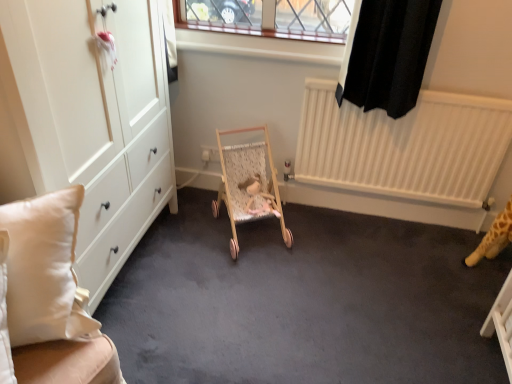
What do you see at coordinates (49, 296) in the screenshot?
I see `white fabric cushion at left` at bounding box center [49, 296].

The height and width of the screenshot is (384, 512). Identify the location of white fabric cushion at left. (49, 296).

The height and width of the screenshot is (384, 512). What do you see at coordinates (249, 184) in the screenshot?
I see `wooden baby carriage at center` at bounding box center [249, 184].

I want to click on wooden baby carriage at center, so click(249, 184).

Measure the distance between wooden baby carriage at center and camera.

wooden baby carriage at center and camera are 6.67 feet apart.

This screenshot has width=512, height=384. In order to click on white fabric cushion at left in this screenshot , I will do `click(49, 296)`.

Considering the positions of objects wooden baby carriage at center and white fabric cushion at left in the image provided, who is more to the left, wooden baby carriage at center or white fabric cushion at left?

From the viewer's perspective, white fabric cushion at left appears more on the left side.

Considering the positions of objects wooden baby carriage at center and white fabric cushion at left in the image provided, who is behind, wooden baby carriage at center or white fabric cushion at left?

wooden baby carriage at center is further from the camera.

Is point (229, 180) positioned behind point (13, 225)?

Yes, it is.

From the image's perspective, does wooden baby carriage at center appear higher than white fabric cushion at left?

Yes, from the image's perspective, wooden baby carriage at center is on top of white fabric cushion at left.

From a real-world perspective, between wooden baby carriage at center and white fabric cushion at left, who is vertically higher?

white fabric cushion at left.

Considering the relative sizes of wooden baby carriage at center and white fabric cushion at left in the image provided, is wooden baby carriage at center wider than white fabric cushion at left?

Correct, the width of wooden baby carriage at center exceeds that of white fabric cushion at left.

Considering the sizes of wooden baby carriage at center and white fabric cushion at left in the image, is wooden baby carriage at center taller or shorter than white fabric cushion at left?

Considering their sizes, wooden baby carriage at center has less height than white fabric cushion at left.

Looking at the image, does wooden baby carriage at center seem bigger or smaller compared to white fabric cushion at left?

wooden baby carriage at center is smaller than white fabric cushion at left.

Is white fabric cushion at left a part of wooden baby carriage at center?

No, wooden baby carriage at center does not contain white fabric cushion at left.

Are wooden baby carriage at center and white fabric cushion at left beside each other?

There is a gap between wooden baby carriage at center and white fabric cushion at left.

Does wooden baby carriage at center turn towards white fabric cushion at left?

No, wooden baby carriage at center is not aimed at white fabric cushion at left.

Can you tell me how much wooden baby carriage at center and white fabric cushion at left differ in facing direction?

The angular difference between wooden baby carriage at center and white fabric cushion at left is 3.98 degrees.

Measure the distance from wooden baby carriage at center to white fabric cushion at left.

wooden baby carriage at center and white fabric cushion at left are 3.50 feet apart.

Locate an element on the screen. baby carriage to the right of white fabric cushion at left is located at coordinates (249, 184).

Based on the photo, considering the relative positions of white fabric cushion at left and wooden baby carriage at center in the image provided, is white fabric cushion at left to the left of wooden baby carriage at center from the viewer's perspective?

Correct, you'll find white fabric cushion at left to the left of wooden baby carriage at center.

Is white fabric cushion at left positioned before wooden baby carriage at center?

Yes, white fabric cushion at left is closer to the viewer.

Does point (0, 248) lie in front of point (234, 217)?

Yes, it is.

From the image's perspective, between white fabric cushion at left and wooden baby carriage at center, who is located below?

From the image's view, white fabric cushion at left is below.

From a real-world perspective, is white fabric cushion at left positioned over wooden baby carriage at center based on gravity?

Yes, from a real-world perspective, white fabric cushion at left is on top of wooden baby carriage at center.

Is white fabric cushion at left thinner than wooden baby carriage at center?

Yes, white fabric cushion at left is thinner than wooden baby carriage at center.

In the scene shown: Who is shorter, white fabric cushion at left or wooden baby carriage at center?

wooden baby carriage at center is shorter.

Considering the sizes of white fabric cushion at left and wooden baby carriage at center in the image, is white fabric cushion at left bigger or smaller than wooden baby carriage at center?

Clearly, white fabric cushion at left is larger in size than wooden baby carriage at center.

Do you think white fabric cushion at left is within wooden baby carriage at center, or outside of it?

white fabric cushion at left is not enclosed by wooden baby carriage at center.

Is white fabric cushion at left next to wooden baby carriage at center and touching it?

No.

Is white fabric cushion at left turned away from wooden baby carriage at center?

white fabric cushion at left is not turned away from wooden baby carriage at center.

How many degrees apart are the facing directions of white fabric cushion at left and wooden baby carriage at center?

The facing directions of white fabric cushion at left and wooden baby carriage at center are 3.98 degrees apart.

Find the location of `furniture on the left of the wooden baby carriage at center`. furniture on the left of the wooden baby carriage at center is located at coordinates (49, 296).

Where is `furniture below the wooden baby carriage at center (from the image's perspective)`? furniture below the wooden baby carriage at center (from the image's perspective) is located at coordinates (49, 296).

Find the location of `furniture above the wooden baby carriage at center (from a real-world perspective)`. furniture above the wooden baby carriage at center (from a real-world perspective) is located at coordinates (49, 296).